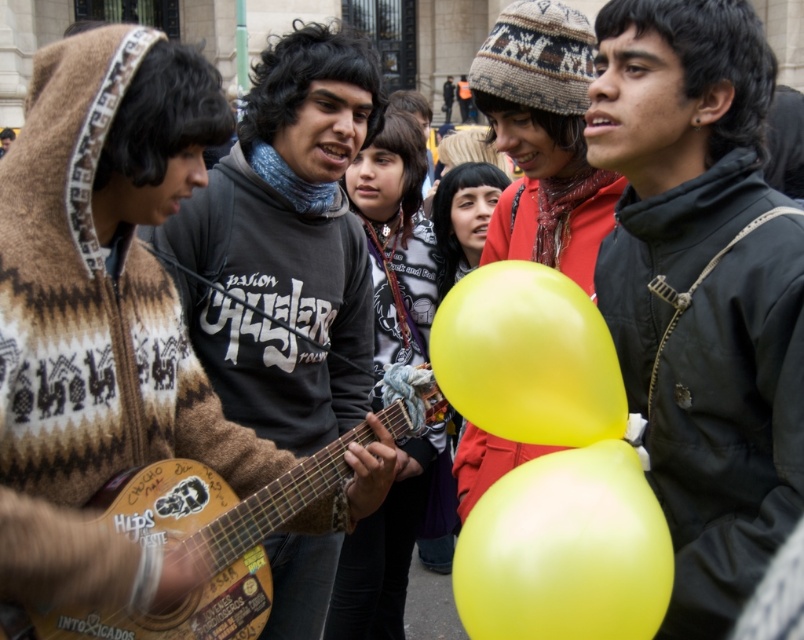
Question: Is knitted wool sweater at center smaller than yellow rubber balloon at center?

Choices:
 (A) no
 (B) yes

Answer: (A)

Question: Can you confirm if wooden acoustic guitar at left is thinner than yellow rubber balloon at center?

Choices:
 (A) yes
 (B) no

Answer: (B)

Question: Is matte black jacket at center closer to camera compared to yellow rubber balloon at center?

Choices:
 (A) yes
 (B) no

Answer: (A)

Question: Estimate the real-world distances between objects in this image. Which object is farther from the yellow matte balloon at center?

Choices:
 (A) wooden acoustic guitar at left
 (B) matte black jacket at center
 (C) yellow rubber balloon at center
 (D) knitted wool sweater at center

Answer: (D)

Question: Which of the following is the closest to the observer?

Choices:
 (A) yellow rubber balloon at center
 (B) knitted wool sweater at center
 (C) matte black jacket at center

Answer: (C)

Question: Which of the following is the farthest from the observer?

Choices:
 (A) (234, 164)
 (B) (495, 323)
 (C) (238, 556)

Answer: (A)